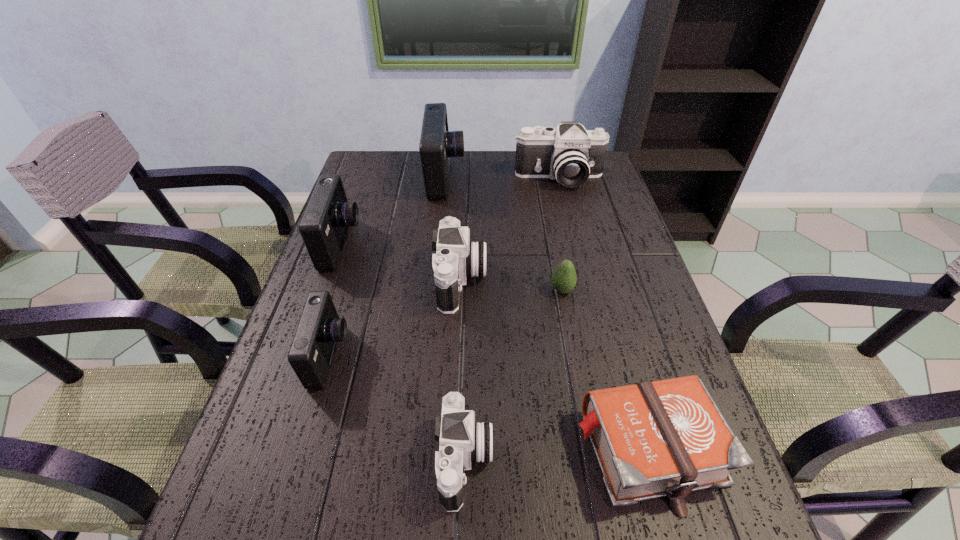
What are the coordinates of `green avocado` in the screenshot? It's located at (564, 278).

Image resolution: width=960 pixels, height=540 pixels. What are the coordinates of `Bible` in the screenshot? It's located at (667, 438).

At what (x,y) coordinates should I click in order to perform the action: click on vacant point located 0.370m on the front-facing side of the biggest blue camera. Please return your answer as a coordinate pair (x, y). The image size is (960, 540). Looking at the image, I should click on (575, 178).

Locate an element on the screen. vacant space located on the front of the rightmost black camera is located at coordinates (582, 276).

You are a GUI agent. You are given a task and a screenshot of the screen. Output one action in this format:
    pyautogui.click(x=<x>, y=<y>)
    Task: Click on the vacant space located 0.360m on the front-facing side of the second nearest blue camera
    The image size is (960, 540).
    Given the screenshot: What is the action you would take?
    pyautogui.click(x=490, y=245)

Find the location of a particular element. This screenshot has height=540, width=960. free space located 0.270m on the left of the second nearest black camera is located at coordinates (329, 280).

Find the location of a particular element. This screenshot has width=960, height=540. free region located 0.350m on the front-facing side of the nearest blue camera is located at coordinates (510, 356).

You are a GUI agent. You are given a task and a screenshot of the screen. Output one action in this format:
    pyautogui.click(x=<x>, y=<y>)
    Task: Click on the vacant space located on the right of the smallest black camera
    The height and width of the screenshot is (540, 960).
    Given the screenshot: What is the action you would take?
    pyautogui.click(x=581, y=461)

The width and height of the screenshot is (960, 540). In order to click on free location located 0.360m on the left of the avocado in this screenshot , I will do `click(405, 290)`.

The height and width of the screenshot is (540, 960). What are the coordinates of `vacant region located 0.260m on the left of the Bible` in the screenshot? It's located at (438, 450).